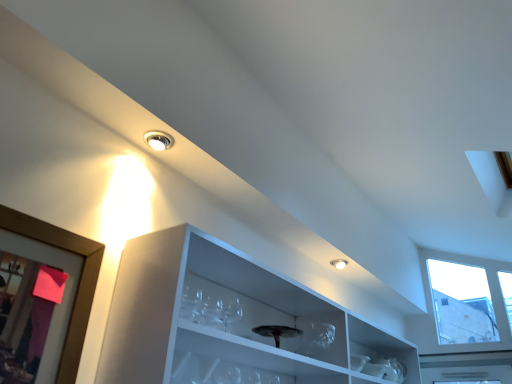
Question: Is clear glass wine glass at center placed right next to wooden picture frame at left?

Choices:
 (A) no
 (B) yes

Answer: (A)

Question: Is clear glass wine glass at center positioned in front of wooden picture frame at left?

Choices:
 (A) yes
 (B) no

Answer: (B)

Question: Can you confirm if clear glass wine glass at center is thinner than wooden picture frame at left?

Choices:
 (A) no
 (B) yes

Answer: (A)

Question: Is there a large distance between clear glass wine glass at center and wooden picture frame at left?

Choices:
 (A) no
 (B) yes

Answer: (A)

Question: Does clear glass wine glass at center appear on the right side of wooden picture frame at left?

Choices:
 (A) no
 (B) yes

Answer: (B)

Question: Based on their sizes in the image, would you say wooden picture frame at left is bigger or smaller than matte white droplight at upper center?

Choices:
 (A) big
 (B) small

Answer: (A)

Question: Would you say wooden picture frame at left is inside or outside matte white droplight at upper center?

Choices:
 (A) inside
 (B) outside

Answer: (B)

Question: Based on their positions, is wooden picture frame at left located to the left or right of matte white droplight at upper center?

Choices:
 (A) left
 (B) right

Answer: (A)

Question: Relative to matte white droplight at upper center, is wooden picture frame at left in front or behind?

Choices:
 (A) front
 (B) behind

Answer: (A)

Question: Looking at their shapes, would you say clear glass wine glass at center is wider or thinner than wooden picture frame at left?

Choices:
 (A) thin
 (B) wide

Answer: (B)

Question: Considering the positions of clear glass wine glass at center and wooden picture frame at left in the image, is clear glass wine glass at center bigger or smaller than wooden picture frame at left?

Choices:
 (A) big
 (B) small

Answer: (B)

Question: From the image's perspective, is clear glass wine glass at center above or below wooden picture frame at left?

Choices:
 (A) below
 (B) above

Answer: (A)

Question: Which is correct: clear glass wine glass at center is inside wooden picture frame at left, or outside of it?

Choices:
 (A) inside
 (B) outside

Answer: (B)

Question: In terms of width, does matte white droplight at upper center look wider or thinner when compared to wooden picture frame at left?

Choices:
 (A) wide
 (B) thin

Answer: (A)

Question: Looking at the image, does matte white droplight at upper center seem bigger or smaller compared to wooden picture frame at left?

Choices:
 (A) small
 (B) big

Answer: (A)